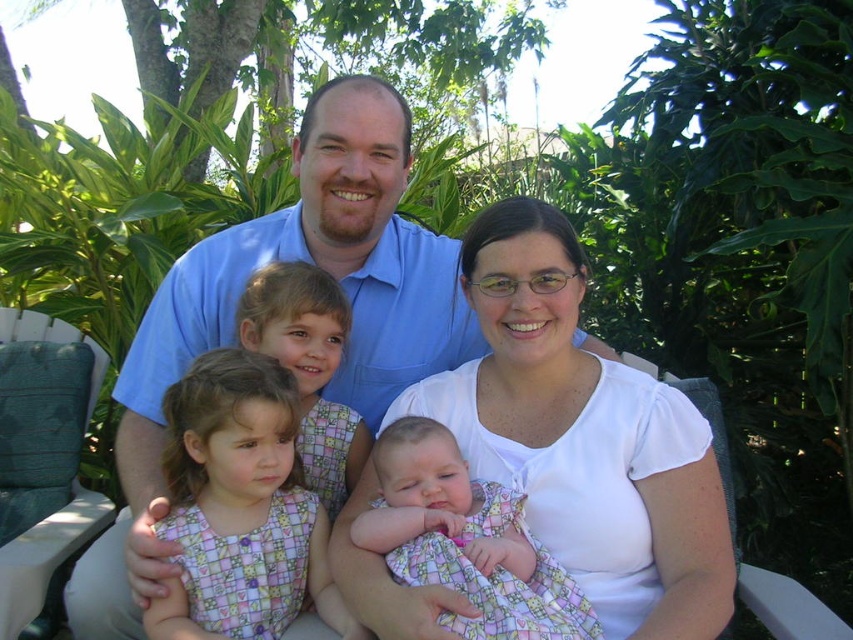
Question: Can you confirm if blue cotton shirt at center is positioned to the right of green fabric chair at left?

Choices:
 (A) no
 (B) yes

Answer: (B)

Question: Does white cotton shirt at center appear on the left side of green fabric chair at left?

Choices:
 (A) yes
 (B) no

Answer: (B)

Question: Which point is farther to the camera?

Choices:
 (A) (47, 358)
 (B) (350, 381)
 (C) (314, 557)
 (D) (386, 468)

Answer: (A)

Question: Estimate the real-world distances between objects in this image. Which object is closer to the green fabric chair at left?

Choices:
 (A) plaid fabric dress at lower left
 (B) white cotton shirt at center
 (C) floral fabric baby at center
 (D) blue cotton shirt at center

Answer: (D)

Question: Estimate the real-world distances between objects in this image. Which object is farther from the blue cotton shirt at center?

Choices:
 (A) plaid fabric dress at lower left
 (B) floral fabric baby at center

Answer: (B)

Question: Does blue cotton shirt at center appear under plaid fabric dress at lower left?

Choices:
 (A) yes
 (B) no

Answer: (B)